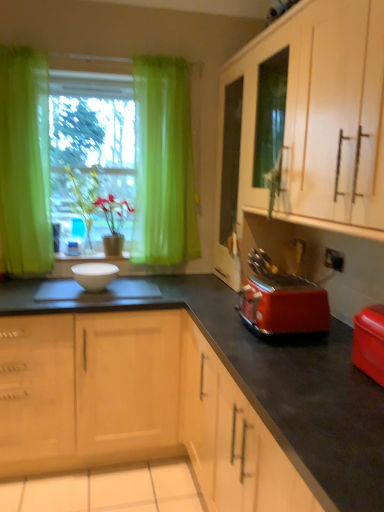
Question: Should I look upward or downward to see green leafy plant at center?

Choices:
 (A) down
 (B) up

Answer: (B)

Question: Is matte wood cabinet at upper right located within green leafy plant at center?

Choices:
 (A) no
 (B) yes

Answer: (A)

Question: Can you confirm if green leafy plant at center is positioned to the left of matte wood cabinet at upper right?

Choices:
 (A) yes
 (B) no

Answer: (A)

Question: Does green leafy plant at center have a larger size compared to matte wood cabinet at upper right?

Choices:
 (A) yes
 (B) no

Answer: (B)

Question: Is green leafy plant at center wider than matte wood cabinet at upper right?

Choices:
 (A) no
 (B) yes

Answer: (A)

Question: From the image's perspective, is green leafy plant at center beneath matte wood cabinet at upper right?

Choices:
 (A) yes
 (B) no

Answer: (A)

Question: Is green leafy plant at center outside of matte wood cabinet at upper right?

Choices:
 (A) yes
 (B) no

Answer: (A)

Question: Is white glossy bowl at center oriented away from white glossy bowl at center?

Choices:
 (A) yes
 (B) no

Answer: (A)

Question: Is white glossy bowl at center positioned before white glossy bowl at center?

Choices:
 (A) no
 (B) yes

Answer: (B)

Question: Can you see white glossy bowl at center touching white glossy bowl at center?

Choices:
 (A) no
 (B) yes

Answer: (A)

Question: From the image's perspective, does white glossy bowl at center appear lower than white glossy bowl at center?

Choices:
 (A) yes
 (B) no

Answer: (A)

Question: Is white glossy bowl at center wider than white glossy bowl at center?

Choices:
 (A) yes
 (B) no

Answer: (B)

Question: Could you tell me if white glossy bowl at center is facing white glossy bowl at center?

Choices:
 (A) yes
 (B) no

Answer: (B)

Question: Are red plastic toaster at lower right and white glossy bowl at center located far from each other?

Choices:
 (A) no
 (B) yes

Answer: (A)